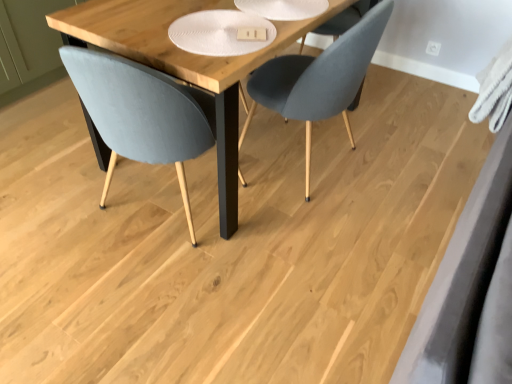
You are a GUI agent. You are given a task and a screenshot of the screen. Output one action in this format:
    pyautogui.click(x=<x>, y=<y>)
    Task: Click on the empty space that is to the right of wooden table at center
    
    Given the screenshot: What is the action you would take?
    pyautogui.click(x=407, y=149)